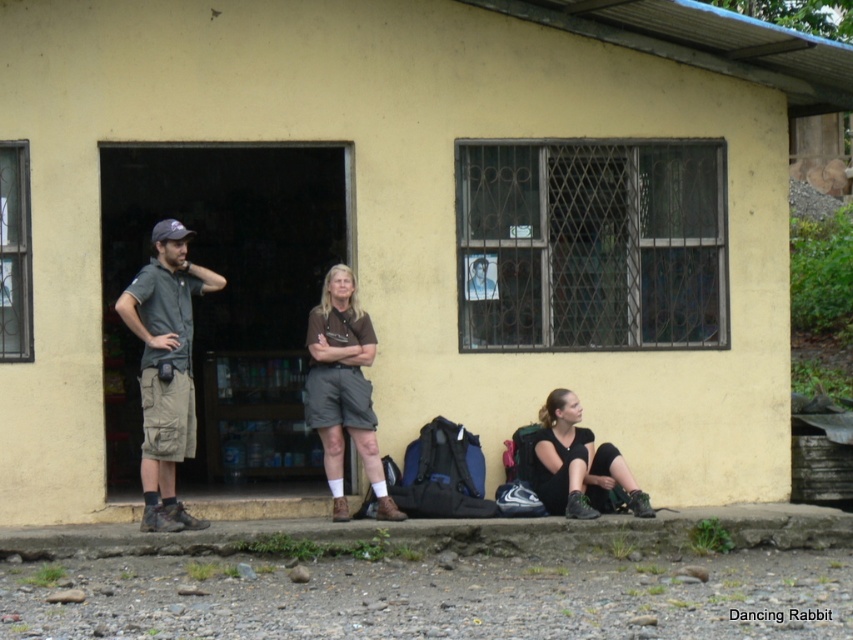
Question: Can you confirm if dark gray fabric shirt at left is thinner than brown matte shorts at center?

Choices:
 (A) no
 (B) yes

Answer: (A)

Question: Is dark gray fabric shirt at left thinner than brown matte shorts at center?

Choices:
 (A) no
 (B) yes

Answer: (A)

Question: Which object appears farthest from the camera in this image?

Choices:
 (A) khaki cargo shorts at center
 (B) black matte leggings at lower right
 (C) dark gray fabric shirt at left
 (D) brown matte shorts at center

Answer: (D)

Question: Which object appears closest to the camera in this image?

Choices:
 (A) brown matte shorts at center
 (B) black matte leggings at lower right
 (C) khaki cargo shorts at center
 (D) dark gray fabric shirt at left

Answer: (D)

Question: Which of the following is the farthest from the observer?

Choices:
 (A) 593,461
 (B) 334,285
 (C) 187,289

Answer: (A)

Question: Is khaki cargo shorts at center above dark gray fabric shirt at left?

Choices:
 (A) no
 (B) yes

Answer: (A)